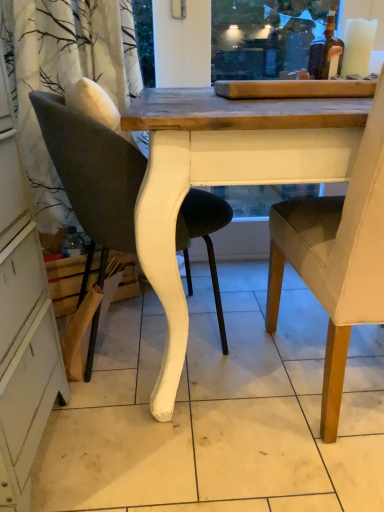
At what (x,y) coordinates should I click in order to perform the action: click on vacant space that is in between white painted wood chair at left, which is the 1th chair in left-to-right order, and light brown fabric chair at right, which is the 1th chair in right-to-left order. Please return your answer as a coordinate pair (x, y). Looking at the image, I should click on pos(220,388).